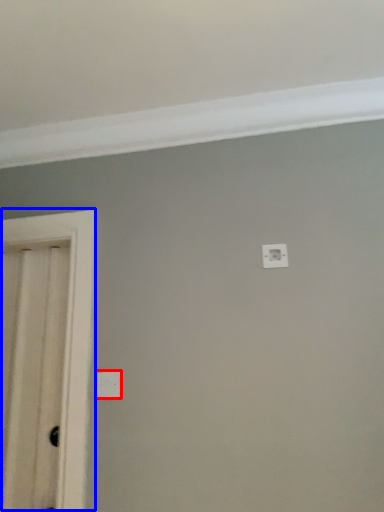
Question: Which of the following is the farthest to the observer, light switch (highlighted by a red box) or door (highlighted by a blue box)?

Choices:
 (A) light switch
 (B) door

Answer: (A)